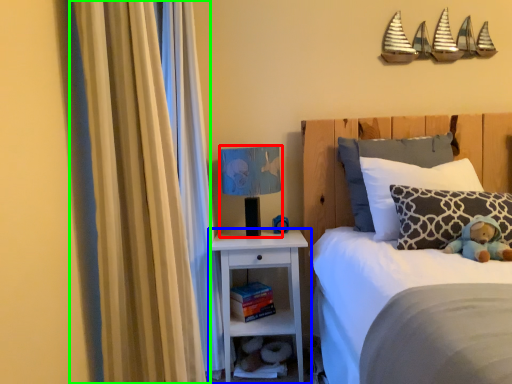
Question: Estimate the real-world distances between objects in this image. Which object is closer to table lamp (highlighted by a red box), nightstand (highlighted by a blue box) or curtain (highlighted by a green box)?

Choices:
 (A) nightstand
 (B) curtain

Answer: (A)